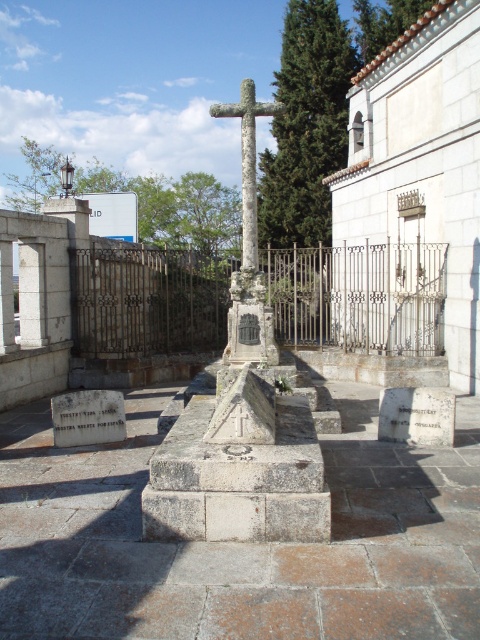
You are a visitor at the cemetery and want to place a flower at the base of the stone cross at center. However, you notice there is a white stone gravestone at center nearby. Which object should you place the flower on, and why?

You should place the flower at the base of the stone cross at center because it is positioned over the white stone gravestone at center, indicating it is the primary memorial structure.

You are standing in front of the cemetery scene and want to place a wreath on the nearest object between the stone cross at center and the white stone gravestone at center. Which object should you place it on?

The stone cross at center is closer to you than the white stone gravestone at center, so you should place the wreath on the stone cross at center.